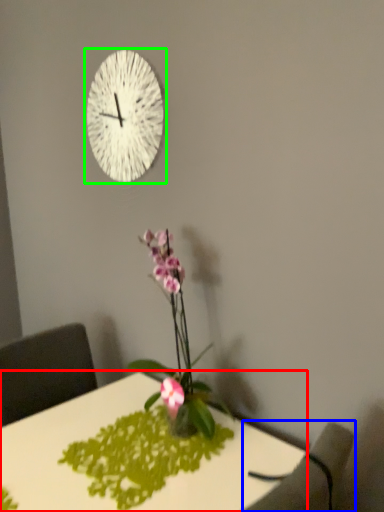
Question: Which is nearer to the desk (highlighted by a red box)? armchair (highlighted by a blue box) or wall clock (highlighted by a green box).

Choices:
 (A) armchair
 (B) wall clock

Answer: (A)